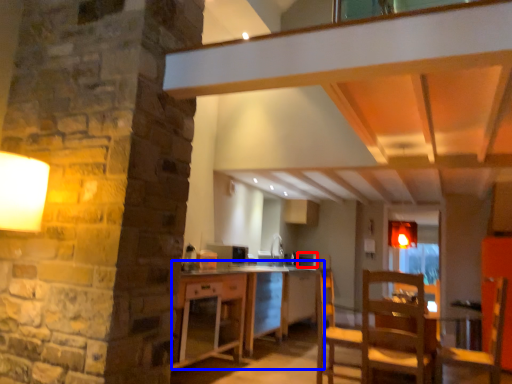
Question: Among these objects, which one is nearest to the camera, appliance (highlighted by a red box) or table (highlighted by a blue box)?

Choices:
 (A) appliance
 (B) table

Answer: (B)